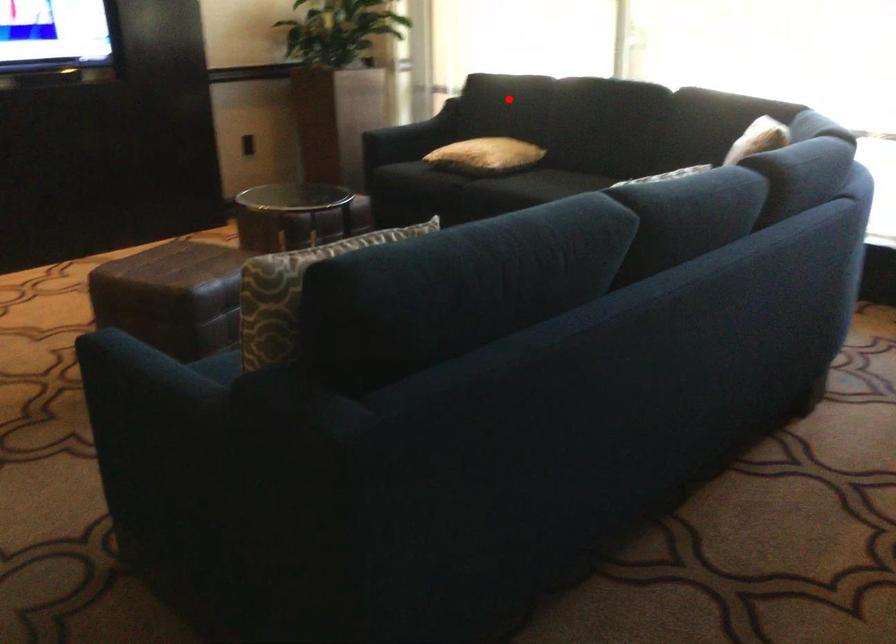
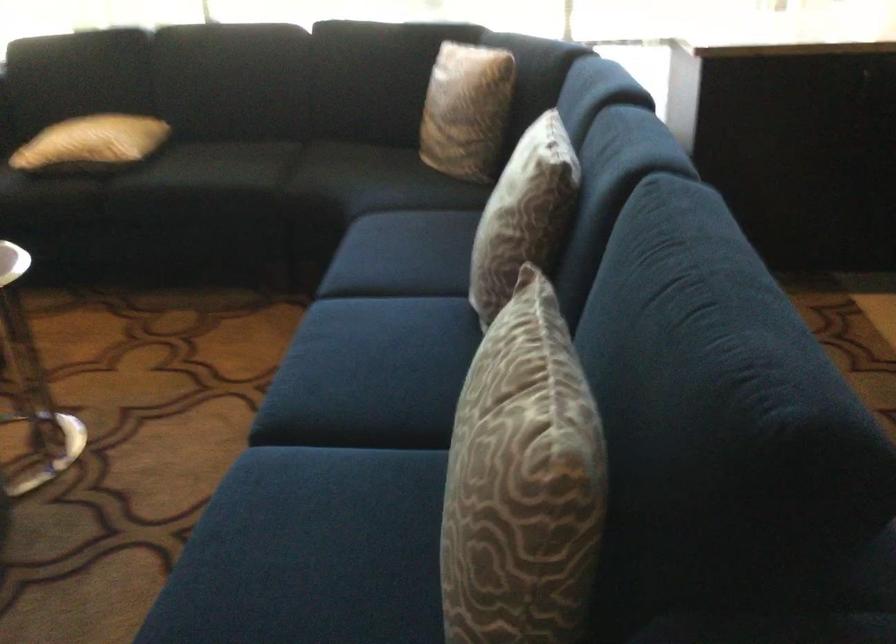
Question: I am providing you with two images of the same scene from different viewpoints. Image1 has a red point marked. In image2, the corresponding 3D location appears at what relative position? Reply with the corresponding letter.

Choices:
 (A) Closer
 (B) Farther

Answer: (A)